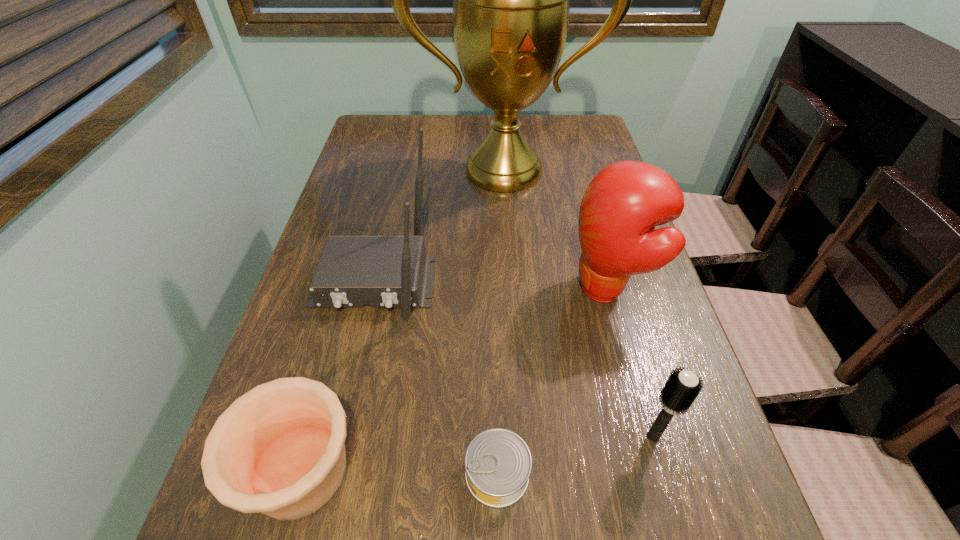
Where is `free spot that satisfies the following two spatial constraints: 1. on the back of the hairbrush to connect cables; 2. on the left side of the router`? Image resolution: width=960 pixels, height=540 pixels. free spot that satisfies the following two spatial constraints: 1. on the back of the hairbrush to connect cables; 2. on the left side of the router is located at coordinates (338, 437).

Image resolution: width=960 pixels, height=540 pixels. In order to click on free space that satisfies the following two spatial constraints: 1. on the back of the router to connect cables; 2. on the left side of the shortest object in this screenshot , I will do `click(330, 474)`.

Locate an element on the screen. Image resolution: width=960 pixels, height=540 pixels. vacant region that satisfies the following two spatial constraints: 1. on the striking surface of the boxing glove; 2. on the front side of the pottery is located at coordinates (657, 471).

This screenshot has height=540, width=960. I want to click on vacant space that satisfies the following two spatial constraints: 1. on the back of the shortest object to connect cables; 2. on the left side of the router, so click(x=330, y=474).